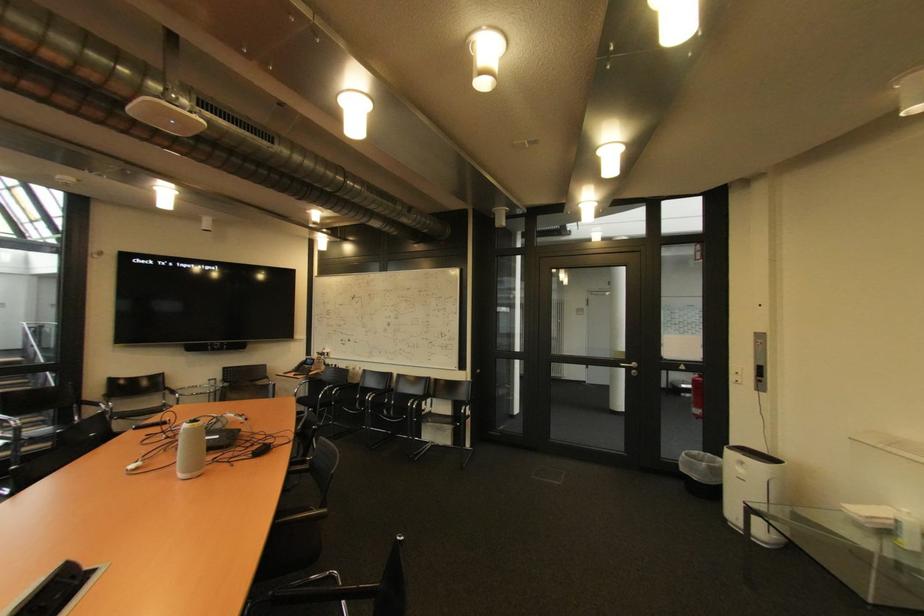
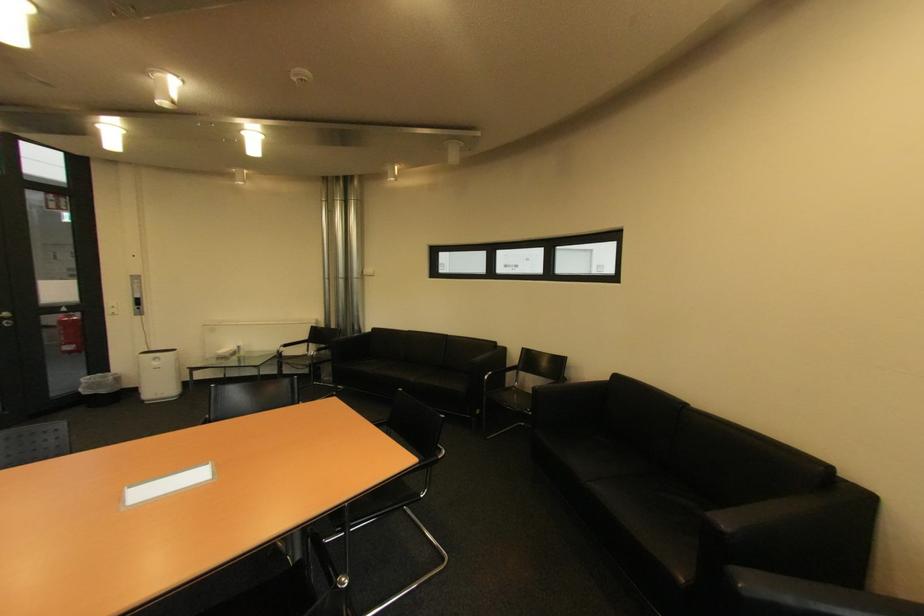
Locate, in the second image, the point that corresponds to pixel 706 413 in the first image.

(79, 349)